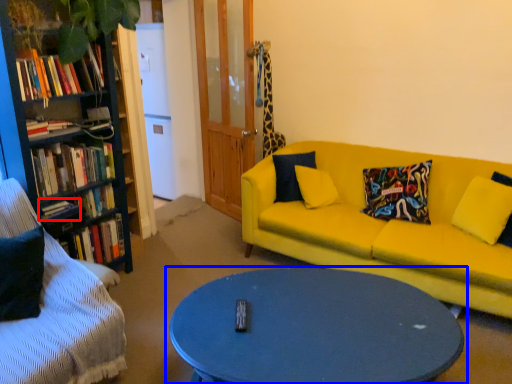
Question: Which object appears farthest to the camera in this image, book (highlighted by a red box) or coffee table (highlighted by a blue box)?

Choices:
 (A) book
 (B) coffee table

Answer: (A)